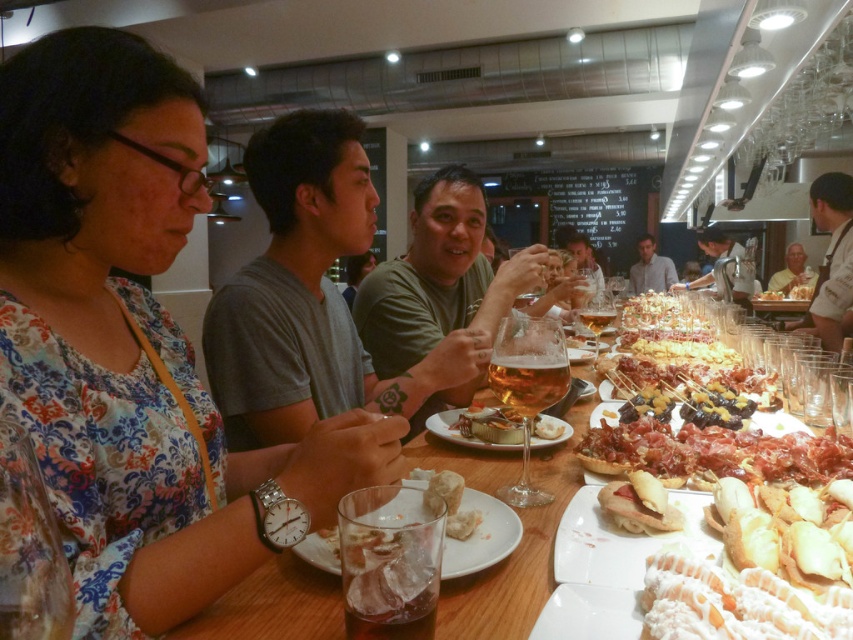
Who is lower down, translucent glass wine glass at center or amber glass at center?

translucent glass wine glass at center is below.

Image resolution: width=853 pixels, height=640 pixels. What do you see at coordinates (527, 385) in the screenshot? I see `translucent glass wine glass at center` at bounding box center [527, 385].

Is point (520, 321) closer to viewer compared to point (549, 392)?

That is False.

This screenshot has width=853, height=640. In order to click on translucent glass wine glass at center in this screenshot , I will do `click(527, 385)`.

Does matte glass wine glass at center have a lesser height compared to white matte face at upper right?

No, matte glass wine glass at center is not shorter than white matte face at upper right.

Measure the distance between matte glass wine glass at center and camera.

matte glass wine glass at center and camera are 2.79 meters apart from each other.

This screenshot has height=640, width=853. What do you see at coordinates (585, 268) in the screenshot?
I see `matte glass wine glass at center` at bounding box center [585, 268].

Where is `matte glass wine glass at center`? This screenshot has height=640, width=853. matte glass wine glass at center is located at coordinates (585, 268).

Does green matte shirt at center appear on the right side of metallic silver tray at upper center?

In fact, green matte shirt at center is to the left of metallic silver tray at upper center.

Is point (415, 227) closer to camera compared to point (714, 244)?

That is True.

Identify the location of green matte shirt at center. (439, 276).